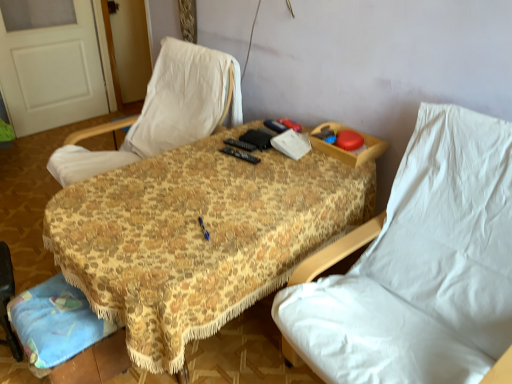
This screenshot has width=512, height=384. Find the location of `white matte door at upper left`. white matte door at upper left is located at coordinates (51, 72).

The height and width of the screenshot is (384, 512). What do you see at coordinates (422, 267) in the screenshot?
I see `white fabric chair at right, the second chair viewed from the left` at bounding box center [422, 267].

Find the location of `white fabric chair at center, which ranks as the 1th chair in left-to-right order`. white fabric chair at center, which ranks as the 1th chair in left-to-right order is located at coordinates (163, 112).

Locate an element on the screen. This screenshot has width=512, height=384. floral fabric table at center is located at coordinates (199, 236).

Which object is positioned more to the right, white matte door at upper left or white fabric chair at center, which ranks as the 1th chair in left-to-right order?

white fabric chair at center, which ranks as the 1th chair in left-to-right order.

From the picture: Is white matte door at upper left closer to the viewer compared to white fabric chair at center, the 2th chair when ordered from right to left?

That is False.

Which is behind, point (73, 7) or point (181, 124)?

Positioned behind is point (73, 7).

Identify the location of the 1st chair below the white matte door at upper left (from the image's perspective). pyautogui.click(x=163, y=112).

Based on the photo, is the surface of white fabric chair at right, positioned as the first chair in right-to-left order, in direct contact with floral fabric table at center?

white fabric chair at right, positioned as the first chair in right-to-left order, is not next to floral fabric table at center, and they're not touching.

From the image's perspective, would you say white fabric chair at right, positioned as the first chair in right-to-left order, is positioned over floral fabric table at center?

Actually, white fabric chair at right, positioned as the first chair in right-to-left order, appears below floral fabric table at center in the image.

In the image, there is a white fabric chair at right, positioned as the first chair in right-to-left order. Identify the location of table below it (from a real-world perspective). (199, 236).

From the picture: Does white fabric chair at right, positioned as the first chair in right-to-left order, have a smaller size compared to floral fabric table at center?

Indeed, white fabric chair at right, positioned as the first chair in right-to-left order, has a smaller size compared to floral fabric table at center.

From a real-world perspective, which object rests below the other?

floral fabric table at center, from a real-world perspective.

Consider the image. Between white fabric chair at center, which ranks as the 1th chair in left-to-right order, and floral fabric table at center, which one appears on the right side from the viewer's perspective?

floral fabric table at center is more to the right.

Is white fabric chair at center, the 2th chair when ordered from right to left, oriented away from floral fabric table at center?

No.

Consider the image. Is white fabric chair at center, the 2th chair when ordered from right to left, spatially inside floral fabric table at center, or outside of it?

white fabric chair at center, the 2th chair when ordered from right to left, is located beyond the bounds of floral fabric table at center.

Considering the relative sizes of floral fabric table at center and white fabric chair at right, positioned as the first chair in right-to-left order, in the image provided, is floral fabric table at center shorter than white fabric chair at right, positioned as the first chair in right-to-left order,?

Yes, floral fabric table at center is shorter than white fabric chair at right, positioned as the first chair in right-to-left order.

Is the surface of floral fabric table at center in direct contact with white fabric chair at right, positioned as the first chair in right-to-left order?

There is a gap between floral fabric table at center and white fabric chair at right, positioned as the first chair in right-to-left order.

Looking at this image, how many degrees apart are the facing directions of floral fabric table at center and white fabric chair at right, positioned as the first chair in right-to-left order?

There is a 5.37-degree angle between the facing directions of floral fabric table at center and white fabric chair at right, positioned as the first chair in right-to-left order.

Based on the photo, which object is closer to the camera taking this photo, floral fabric table at center or white fabric chair at right, positioned as the first chair in right-to-left order?

white fabric chair at right, positioned as the first chair in right-to-left order.

Is white fabric chair at right, positioned as the first chair in right-to-left order, looking in the opposite direction of white fabric chair at center, which ranks as the 1th chair in left-to-right order?

white fabric chair at right, positioned as the first chair in right-to-left order, is not turned away from white fabric chair at center, which ranks as the 1th chair in left-to-right order.

Does white fabric chair at right, positioned as the first chair in right-to-left order, come behind white fabric chair at center, which ranks as the 1th chair in left-to-right order?

That is False.

Are white fabric chair at right, the second chair viewed from the left, and white fabric chair at center, the 2th chair when ordered from right to left, located far from each other?

Yes, white fabric chair at right, the second chair viewed from the left, is far from white fabric chair at center, the 2th chair when ordered from right to left.

Identify the location of chair located above the white fabric chair at right, positioned as the first chair in right-to-left order (from the image's perspective). This screenshot has width=512, height=384. (163, 112).

From a real-world perspective, is white fabric chair at center, the 2th chair when ordered from right to left, located beneath white fabric chair at right, positioned as the first chair in right-to-left order?

Incorrect, from a real-world perspective, white fabric chair at center, the 2th chair when ordered from right to left, is higher than white fabric chair at right, positioned as the first chair in right-to-left order.

Image resolution: width=512 pixels, height=384 pixels. Find the location of `chair that appears above the white fabric chair at right, positioned as the first chair in right-to-left order (from the image's perspective)`. chair that appears above the white fabric chair at right, positioned as the first chair in right-to-left order (from the image's perspective) is located at coordinates (163, 112).

Can you confirm if white fabric chair at center, the 2th chair when ordered from right to left, is taller than white fabric chair at right, positioned as the first chair in right-to-left order?

No, white fabric chair at center, the 2th chair when ordered from right to left, is not taller than white fabric chair at right, positioned as the first chair in right-to-left order.

Considering the relative positions of white fabric chair at center, which ranks as the 1th chair in left-to-right order, and white fabric chair at right, positioned as the first chair in right-to-left order, in the image provided, is white fabric chair at center, which ranks as the 1th chair in left-to-right order, in front of white fabric chair at right, positioned as the first chair in right-to-left order,?

No.

In the image, is floral fabric table at center on the left side or the right side of white fabric chair at center, the 2th chair when ordered from right to left?

floral fabric table at center is positioned on white fabric chair at center, the 2th chair when ordered from right to left,'s right side.

Who is smaller, floral fabric table at center or white fabric chair at center, the 2th chair when ordered from right to left?

Smaller between the two is white fabric chair at center, the 2th chair when ordered from right to left.

Is white fabric chair at center, the 2th chair when ordered from right to left, at the back of floral fabric table at center?

That's not correct — floral fabric table at center is not looking away from white fabric chair at center, the 2th chair when ordered from right to left.

Is floral fabric table at center not close to white fabric chair at center, the 2th chair when ordered from right to left?

No, there isn't a large distance between floral fabric table at center and white fabric chair at center, the 2th chair when ordered from right to left.

From a real-world perspective, count 1st chairs downward from the white matte door at upper left and point to it. Please provide its 2D coordinates.

[(163, 112)]

Find the location of `table located behind the white fabric chair at right, the second chair viewed from the left`. table located behind the white fabric chair at right, the second chair viewed from the left is located at coordinates (199, 236).

Based on their spatial positions, is white fabric chair at center, the 2th chair when ordered from right to left, or white matte door at upper left closer to white fabric chair at right, the second chair viewed from the left?

The object closer to white fabric chair at right, the second chair viewed from the left, is white fabric chair at center, the 2th chair when ordered from right to left.

In the scene shown: Based on their spatial positions, is white fabric chair at right, positioned as the first chair in right-to-left order, or white matte door at upper left closer to white fabric chair at center, which ranks as the 1th chair in left-to-right order?

white fabric chair at right, positioned as the first chair in right-to-left order, lies closer to white fabric chair at center, which ranks as the 1th chair in left-to-right order, than the other object.

Looking at the image, which one is located closer to white fabric chair at right, the second chair viewed from the left, white matte door at upper left or white fabric chair at center, the 2th chair when ordered from right to left?

white fabric chair at center, the 2th chair when ordered from right to left, is closer to white fabric chair at right, the second chair viewed from the left.

Looking at the image, which one is located closer to floral fabric table at center, white fabric chair at right, positioned as the first chair in right-to-left order, or white matte door at upper left?

white fabric chair at right, positioned as the first chair in right-to-left order, lies closer to floral fabric table at center than the other object.

Looking at the image, which one is located further to white fabric chair at center, the 2th chair when ordered from right to left, floral fabric table at center or white fabric chair at right, positioned as the first chair in right-to-left order?

Based on the image, white fabric chair at right, positioned as the first chair in right-to-left order, appears to be further to white fabric chair at center, the 2th chair when ordered from right to left.

Considering their positions, is white fabric chair at right, positioned as the first chair in right-to-left order, positioned closer to white fabric chair at center, the 2th chair when ordered from right to left, than floral fabric table at center?

floral fabric table at center is closer to white fabric chair at center, the 2th chair when ordered from right to left.

From the image, which object appears to be farther from white matte door at upper left, floral fabric table at center or white fabric chair at center, which ranks as the 1th chair in left-to-right order?

The object further to white matte door at upper left is floral fabric table at center.

From the image, which object appears to be farther from white matte door at upper left, white fabric chair at right, the second chair viewed from the left, or floral fabric table at center?

white fabric chair at right, the second chair viewed from the left.

The height and width of the screenshot is (384, 512). Identify the location of table between white fabric chair at center, the 2th chair when ordered from right to left, and white fabric chair at right, the second chair viewed from the left, from left to right. (199, 236).

This screenshot has height=384, width=512. What are the coordinates of `chair between floral fabric table at center and white matte door at upper left from front to back` in the screenshot? It's located at click(x=163, y=112).

Locate an element on the screen. The height and width of the screenshot is (384, 512). chair located between white fabric chair at right, the second chair viewed from the left, and white matte door at upper left in the depth direction is located at coordinates (163, 112).

Find the location of a particular element. This screenshot has width=512, height=384. table between white fabric chair at right, the second chair viewed from the left, and white matte door at upper left, along the z-axis is located at coordinates click(199, 236).